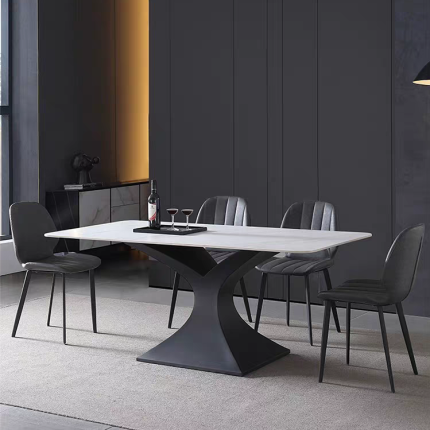
This screenshot has width=430, height=430. What are the coordinates of `bottle` in the screenshot? It's located at (151, 198).